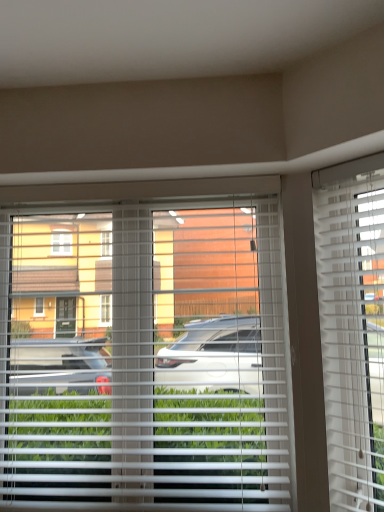
Question: Would you say white plastic blinds at center, which is the 1th window blind in left-to-right order, contains white plastic blinds at right, placed as the 1th window blind when sorted from right to left?

Choices:
 (A) no
 (B) yes

Answer: (A)

Question: From the image's perspective, would you say white plastic blinds at center, which is the 1th window blind in left-to-right order, is shown under white plastic blinds at right, the second window blind in the left-to-right sequence?

Choices:
 (A) no
 (B) yes

Answer: (B)

Question: Is white plastic blinds at center, which is the 1th window blind in left-to-right order, to the left of white plastic blinds at right, placed as the 1th window blind when sorted from right to left, from the viewer's perspective?

Choices:
 (A) yes
 (B) no

Answer: (A)

Question: From a real-world perspective, is white plastic blinds at center, which appears as the 2th window blind when viewed from the right, beneath white plastic blinds at right, the second window blind in the left-to-right sequence?

Choices:
 (A) no
 (B) yes

Answer: (B)

Question: Considering the relative positions of white plastic blinds at center, which is the 1th window blind in left-to-right order, and white plastic blinds at right, placed as the 1th window blind when sorted from right to left, in the image provided, is white plastic blinds at center, which is the 1th window blind in left-to-right order, to the right of white plastic blinds at right, placed as the 1th window blind when sorted from right to left, from the viewer's perspective?

Choices:
 (A) yes
 (B) no

Answer: (B)

Question: Is white plastic blinds at center, which appears as the 2th window blind when viewed from the right, closer to the viewer compared to white plastic blinds at right, the second window blind in the left-to-right sequence?

Choices:
 (A) no
 (B) yes

Answer: (A)

Question: From the image's perspective, would you say white plastic blinds at right, placed as the 1th window blind when sorted from right to left, is positioned over white plastic blinds at center, which is the 1th window blind in left-to-right order?

Choices:
 (A) no
 (B) yes

Answer: (B)

Question: Does white plastic blinds at right, placed as the 1th window blind when sorted from right to left, appear on the right side of white plastic blinds at center, which appears as the 2th window blind when viewed from the right?

Choices:
 (A) yes
 (B) no

Answer: (A)

Question: From a real-world perspective, is white plastic blinds at right, placed as the 1th window blind when sorted from right to left, below white plastic blinds at center, which is the 1th window blind in left-to-right order?

Choices:
 (A) yes
 (B) no

Answer: (B)

Question: Considering the relative sizes of white plastic blinds at right, placed as the 1th window blind when sorted from right to left, and white plastic blinds at center, which is the 1th window blind in left-to-right order, in the image provided, is white plastic blinds at right, placed as the 1th window blind when sorted from right to left, wider than white plastic blinds at center, which is the 1th window blind in left-to-right order,?

Choices:
 (A) no
 (B) yes

Answer: (A)

Question: Is white plastic blinds at right, the second window blind in the left-to-right sequence, completely or partially outside of white plastic blinds at center, which is the 1th window blind in left-to-right order?

Choices:
 (A) no
 (B) yes

Answer: (B)

Question: Can you confirm if white plastic blinds at right, the second window blind in the left-to-right sequence, is thinner than white plastic blinds at center, which appears as the 2th window blind when viewed from the right?

Choices:
 (A) no
 (B) yes

Answer: (B)

Question: Considering the positions of white plastic blinds at center, which is the 1th window blind in left-to-right order, and white plastic blinds at right, the second window blind in the left-to-right sequence, in the image, is white plastic blinds at center, which is the 1th window blind in left-to-right order, taller or shorter than white plastic blinds at right, the second window blind in the left-to-right sequence,?

Choices:
 (A) short
 (B) tall

Answer: (B)